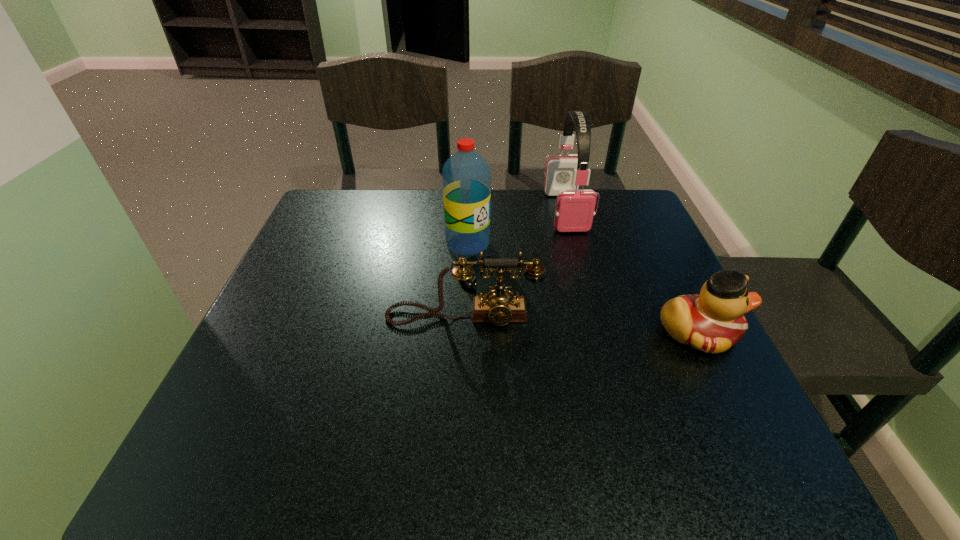
Where is `vacant area that satisfies the following two spatial constraints: 1. on the front-facing side of the duck; 2. on the face of the telephone`? The image size is (960, 540). vacant area that satisfies the following two spatial constraints: 1. on the front-facing side of the duck; 2. on the face of the telephone is located at coordinates (463, 332).

Locate an element on the screen. The height and width of the screenshot is (540, 960). vacant space that satisfies the following two spatial constraints: 1. on the front side of the duck; 2. on the face of the earphone is located at coordinates (598, 332).

You are a GUI agent. You are given a task and a screenshot of the screen. Output one action in this format:
    pyautogui.click(x=<x>, y=<y>)
    Task: Click on the vacant space that satisfies the following two spatial constraints: 1. on the front side of the duck; 2. on the face of the third object from left to right
    The image size is (960, 540).
    Given the screenshot: What is the action you would take?
    pyautogui.click(x=598, y=332)

Find the location of a particular element. free space in the image that satisfies the following two spatial constraints: 1. on the back side of the water bottle; 2. on the left side of the second object from right to left is located at coordinates (469, 211).

Find the location of a particular element. vacant region that satisfies the following two spatial constraints: 1. on the front-facing side of the telephone; 2. on the face of the duck is located at coordinates (463, 332).

Find the location of a particular element. blank space that satisfies the following two spatial constraints: 1. on the front side of the second object from right to left; 2. on the face of the duck is located at coordinates (598, 332).